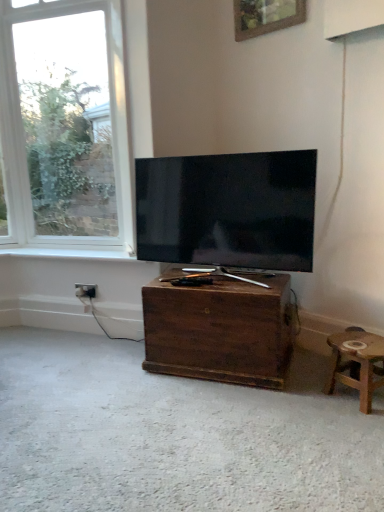
Question: Is clear glass window at upper left inside or outside of matte black tv at center?

Choices:
 (A) inside
 (B) outside

Answer: (B)

Question: From a real-world perspective, relative to matte black tv at center, is clear glass window at upper left vertically above or below?

Choices:
 (A) above
 (B) below

Answer: (A)

Question: Estimate the real-world distances between objects in this image. Which object is closer to the dark wood chest at center?

Choices:
 (A) clear glass window at upper left
 (B) matte black tv at center
 (C) white wood window sill at lower left
 (D) wooden picture frame at upper center
 (E) wooden stool at lower right

Answer: (B)

Question: Which object is the farthest from the matte black tv at center?

Choices:
 (A) dark wood chest at center
 (B) wooden picture frame at upper center
 (C) black plastic power outlet at lower left
 (D) white wood window sill at lower left
 (E) wooden stool at lower right

Answer: (B)